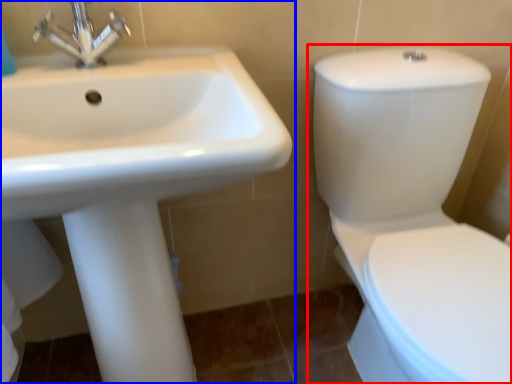
Question: Which point is further to the camera, toilet (highlighted by a red box) or sink (highlighted by a blue box)?

Choices:
 (A) toilet
 (B) sink

Answer: (B)